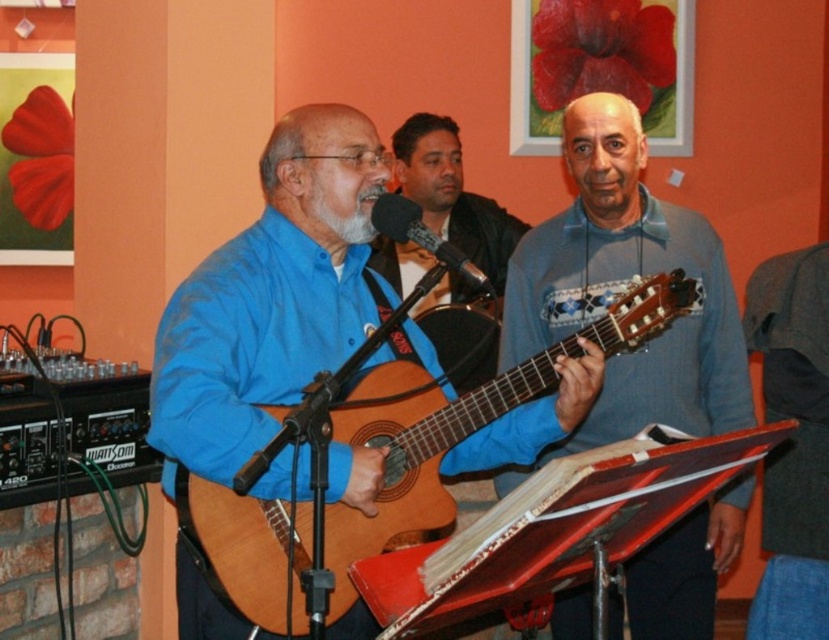
Does blue fabric shirt at center have a greater width compared to black matte microphone at center?

Indeed, blue fabric shirt at center has a greater width compared to black matte microphone at center.

Is point (405, 269) farther from viewer compared to point (393, 225)?

That is True.

What are the coordinates of `blue fabric shirt at center` in the screenshot? It's located at (452, 195).

From the picture: Which is more to the left, wooden acoustic guitar at center or black matte microphone at center?

black matte microphone at center is more to the left.

Is wooden acoustic guitar at center wider than black matte microphone at center?

Yes.

At what (x,y) coordinates should I click in order to perform the action: click on wooden acoustic guitar at center. Please return your answer as a coordinate pair (x, y). The width and height of the screenshot is (829, 640). Looking at the image, I should click on (385, 468).

The image size is (829, 640). Find the location of `wooden acoustic guitar at center`. wooden acoustic guitar at center is located at coordinates (385, 468).

Does wooden acoustic guitar at center have a greater width compared to blue fabric shirt at center?

Correct, the width of wooden acoustic guitar at center exceeds that of blue fabric shirt at center.

Between point (638, 321) and point (415, 188), which one is positioned in front?

Point (638, 321)

Which is in front, point (362, 408) or point (432, 304)?

Point (362, 408)

Image resolution: width=829 pixels, height=640 pixels. Find the location of `wooden acoustic guitar at center`. wooden acoustic guitar at center is located at coordinates (385, 468).